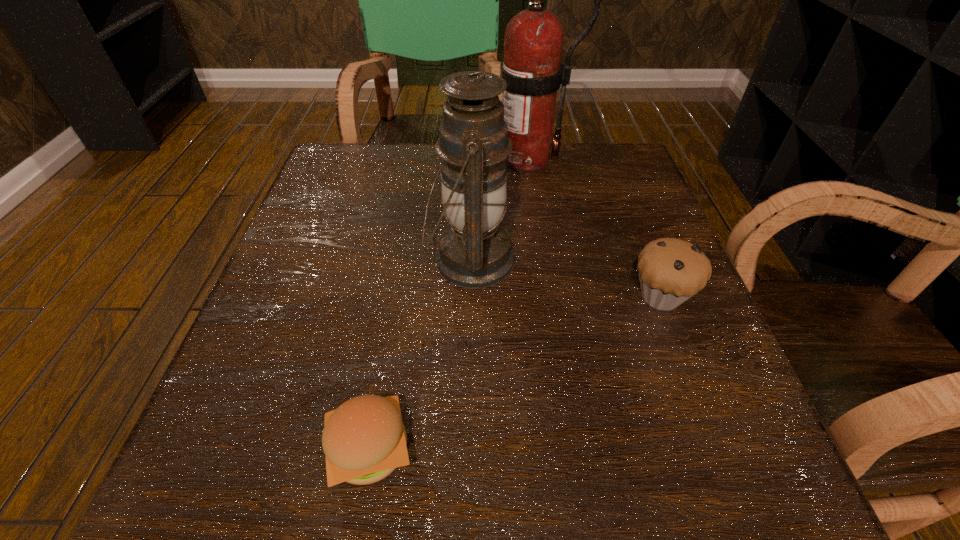
The image size is (960, 540). I want to click on vacant position at the left edge of the desktop, so click(x=298, y=227).

Locate an element on the screen. Image resolution: width=960 pixels, height=540 pixels. vacant space at the right edge of the desktop is located at coordinates (605, 221).

The image size is (960, 540). In the image, there is a desktop. What are the coordinates of `vacant area at the far left corner` in the screenshot? It's located at (382, 173).

The image size is (960, 540). In the image, there is a desktop. Identify the location of vacant space at the near left corner. (184, 474).

In the image, there is a desktop. Identify the location of free space at the far right corner. The image size is (960, 540). (614, 178).

In the image, there is a desktop. Where is `vacant space at the near right corner`? Image resolution: width=960 pixels, height=540 pixels. vacant space at the near right corner is located at coordinates (783, 509).

Find the location of a particular element. This screenshot has height=540, width=960. vacant area that lies between the oil lamp and the muffin is located at coordinates (565, 278).

This screenshot has width=960, height=540. I want to click on empty space between the muffin and the oil lamp, so click(x=565, y=278).

The width and height of the screenshot is (960, 540). Identify the location of unoccupied area between the tallest object and the rightmost object. (593, 227).

Find the location of a particular element. vacant space that is in between the farthest object and the muffin is located at coordinates (593, 227).